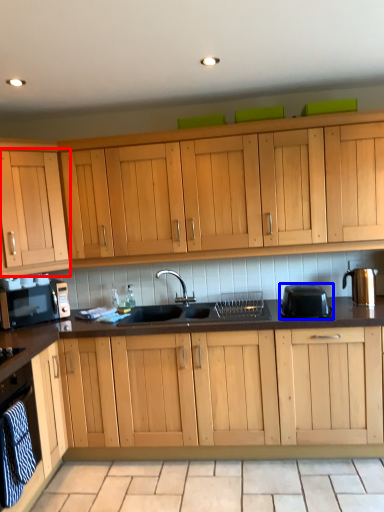
Question: Which object is further to the camera taking this photo, cabinetry (highlighted by a red box) or kitchen appliance (highlighted by a blue box)?

Choices:
 (A) cabinetry
 (B) kitchen appliance

Answer: (A)